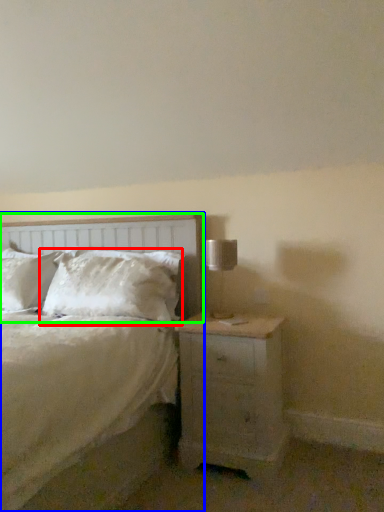
Question: Based on their relative distances, which object is farther from pillow (highlighted by a red box)? Choose from bed (highlighted by a blue box) and headboard (highlighted by a green box).

Choices:
 (A) bed
 (B) headboard

Answer: (A)